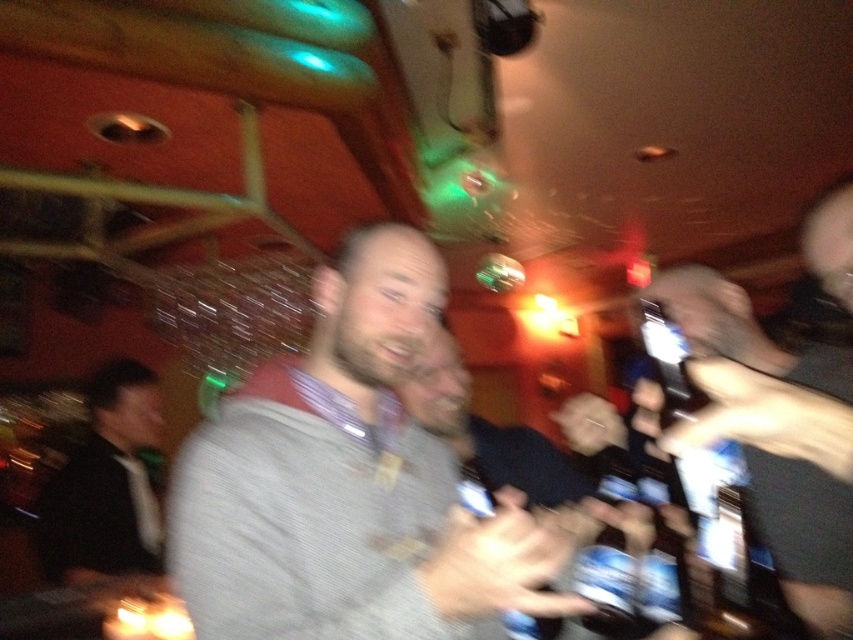
You are at a party and want to grab a drink. There is a clear plastic bottle at right. Based on its position, can you estimate where to look for it relative to the man in the foreground?

The clear plastic bottle at right is located at point 2D coordinates of (721, 540). This means it is positioned towards the lower right corner of the scene, so you should look to the lower right area near the edge of the image to find it.

You are a photographer at the event and want to capture a clear photo of both the smooth leather jacket at right and the smooth plastic hand at center. Given their positions, can you fit both into the frame without moving the camera?

The smooth leather jacket at right and smooth plastic hand at center are 10.74 inches apart. Since the distance between them is fixed, you can adjust your camera zoom to ensure both fit within the frame without moving the camera.